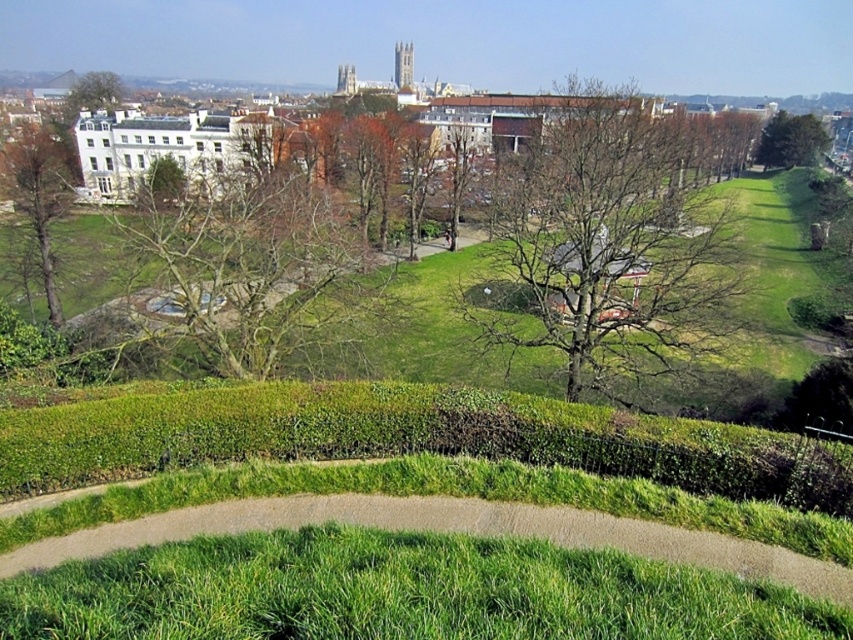
Question: Where is bare wood tree at center located in relation to bare branches at center in the image?

Choices:
 (A) below
 (B) above

Answer: (B)

Question: Which point is closer to the camera?

Choices:
 (A) green grass at lower center
 (B) green leafy tree at upper right
 (C) bare branches at center
 (D) brown leafless tree at left

Answer: (A)

Question: Is green grass at lower center to the left of bare wood tree at center from the viewer's perspective?

Choices:
 (A) no
 (B) yes

Answer: (B)

Question: Which point appears farthest from the camera in this image?

Choices:
 (A) (619, 125)
 (B) (206, 282)
 (C) (390, 550)

Answer: (A)

Question: Which object appears closest to the camera in this image?

Choices:
 (A) green leafy tree at upper right
 (B) brown leafless tree at center
 (C) green leafy tree at upper left

Answer: (B)

Question: Is bare wood tree at center above bare branches at center?

Choices:
 (A) no
 (B) yes

Answer: (B)